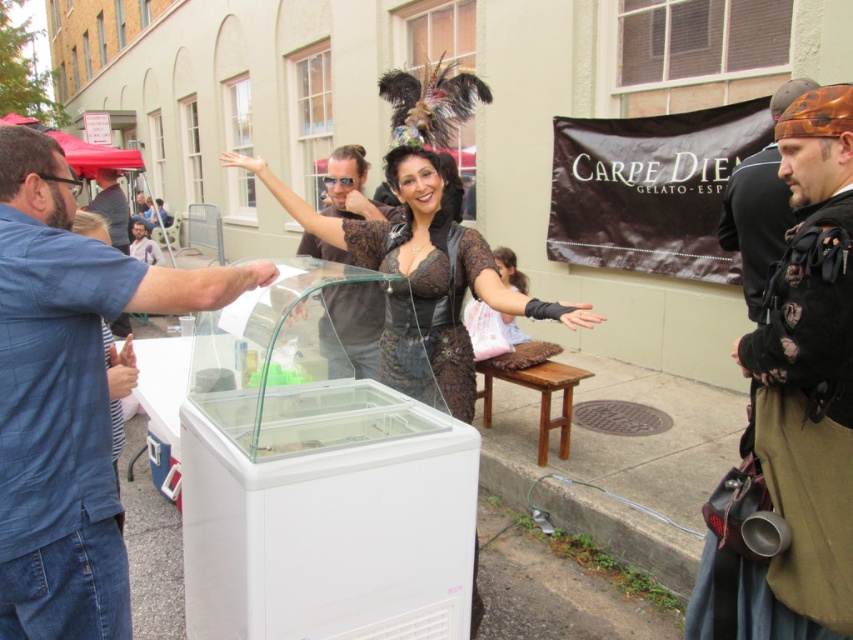
Question: Is blue denim shirt at left bigger than brown leather vest at center-right?

Choices:
 (A) yes
 (B) no

Answer: (A)

Question: Which point is closer to the camera?

Choices:
 (A) brown leather vest at center-right
 (B) matte black shirt at center

Answer: (A)

Question: Can you confirm if brown leather vest at center-right is positioned to the right of matte black shirt at center?

Choices:
 (A) yes
 (B) no

Answer: (A)

Question: Can you confirm if brown leather vest at center-right is positioned to the left of lace fabric dress at center?

Choices:
 (A) no
 (B) yes

Answer: (A)

Question: Which object is closer to the camera taking this photo?

Choices:
 (A) lace fabric corset at center
 (B) lace fabric dress at center
 (C) matte black shirt at center

Answer: (B)

Question: Estimate the real-world distances between objects in this image. Which object is farther from the blue denim shirt at left?

Choices:
 (A) lace fabric corset at center
 (B) lace fabric dress at center
 (C) matte black shirt at center
 (D) brown leather vest at center-right

Answer: (D)